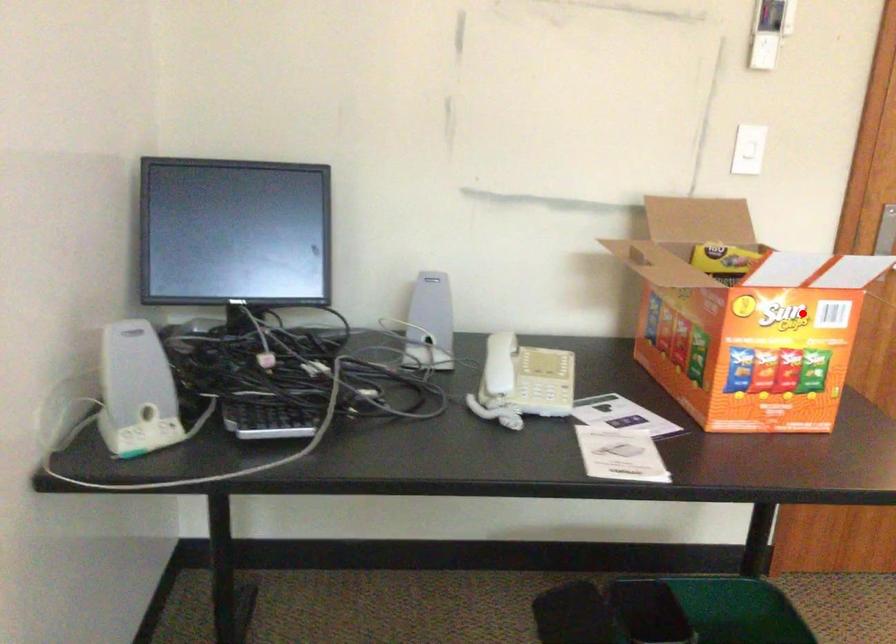
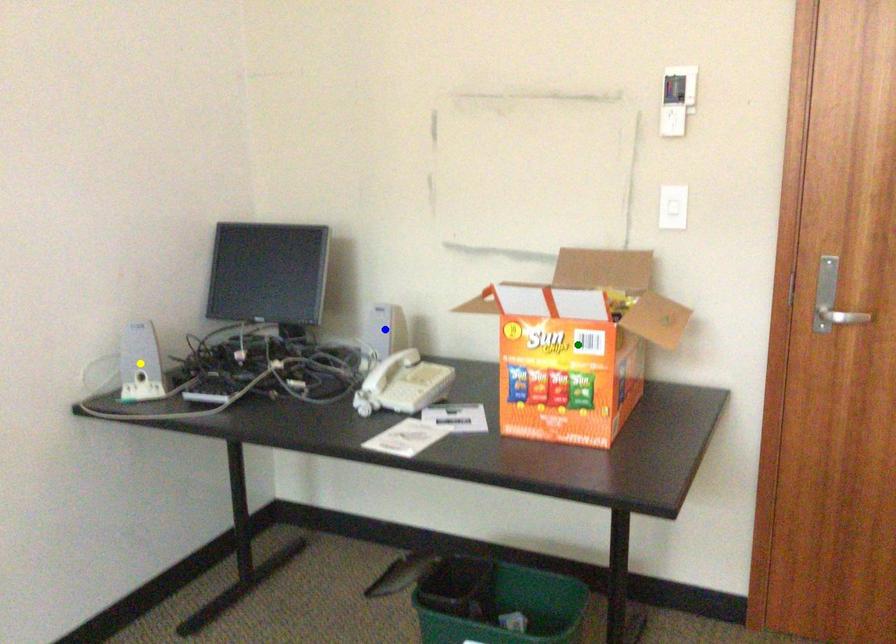
Question: I am providing you with two images of the same scene from different viewpoints. A red point is marked on the first image. You are given multiple points on the second image. Which mark in image 2 goes with the point in image 1?

Choices:
 (A) yellow point
 (B) green point
 (C) blue point

Answer: (B)